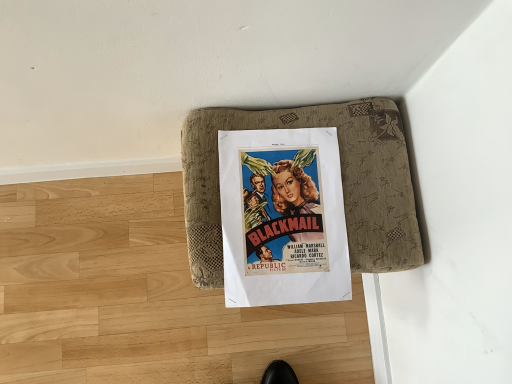
The width and height of the screenshot is (512, 384). In order to click on vacant space situated on the left part of matte paper poster at center in this screenshot , I will do `click(126, 246)`.